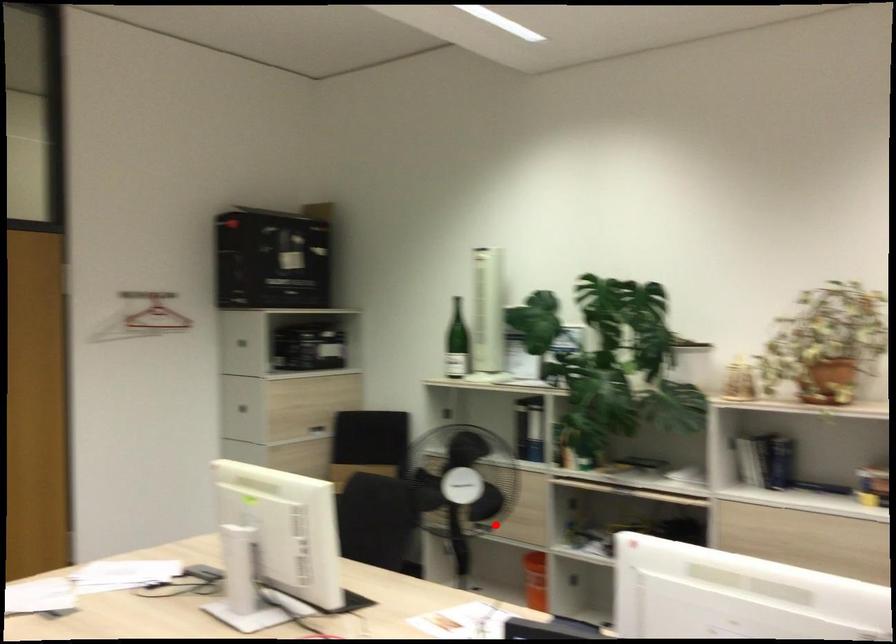
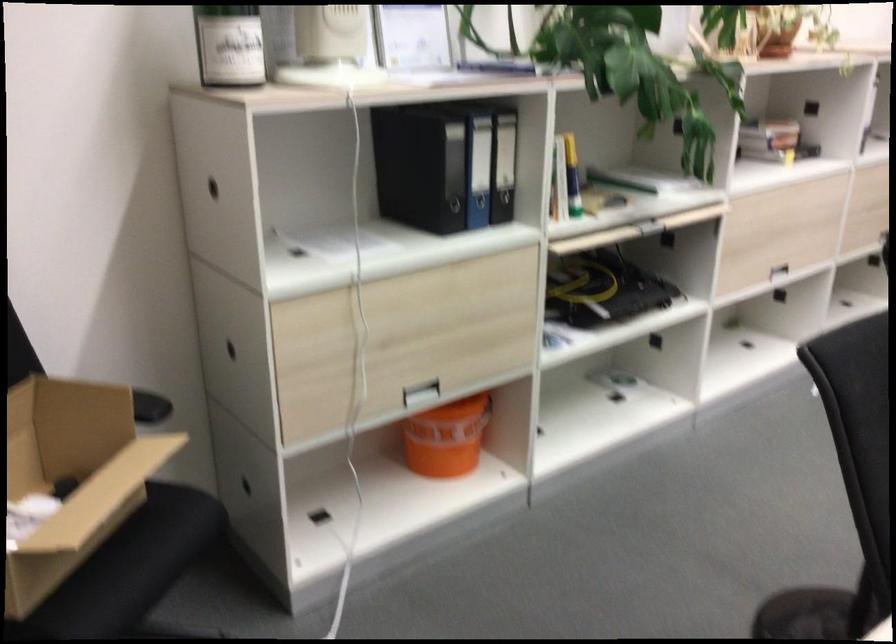
Where in the second image is the point corresponding to the highlighted location from the first image?

(419, 393)